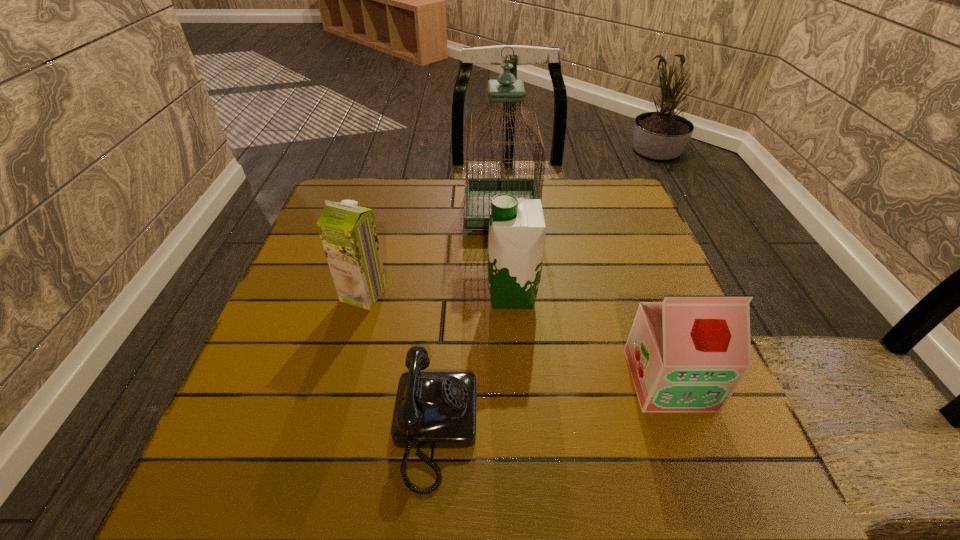
Locate an element on the screen. free space located 0.310m on the front-facing side of the second soya milk from left to right is located at coordinates (348, 295).

What are the coordinates of `vacant space located 0.270m on the front-facing side of the second soya milk from left to right` in the screenshot? It's located at (367, 295).

You are a GUI agent. You are given a task and a screenshot of the screen. Output one action in this format:
    pyautogui.click(x=<x>, y=<y>)
    Task: Click on the free space located on the front-facing side of the second soya milk from left to right
    The height and width of the screenshot is (540, 960).
    Given the screenshot: What is the action you would take?
    pos(362,295)

Locate an element on the screen. This screenshot has width=960, height=540. vacant region located 0.340m on the right of the leftmost object is located at coordinates (538, 294).

At what (x,y) coordinates should I click in order to perform the action: click on free region located 0.110m with the cap open on the nearest soya milk. Please return your answer as a coordinate pair (x, y). Looking at the image, I should click on (705, 476).

At what (x,y) coordinates should I click in order to perform the action: click on free space located 0.310m on the dial of the shortest object. Please return your answer as a coordinate pair (x, y). Looking at the image, I should click on (659, 429).

Locate an element on the screen. The height and width of the screenshot is (540, 960). object that is at the far edge is located at coordinates (479, 191).

Identify the location of object that is at the near edge. This screenshot has width=960, height=540. 433,409.

Locate an element on the screen. object positioned at the left edge is located at coordinates (348, 233).

Locate an element on the screen. The height and width of the screenshot is (540, 960). object that is at the right edge is located at coordinates (688, 353).